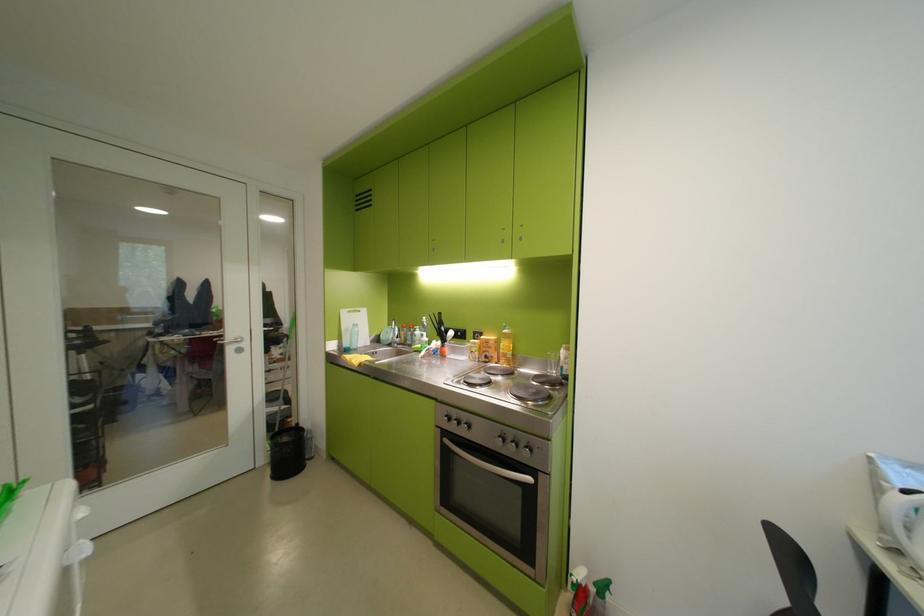
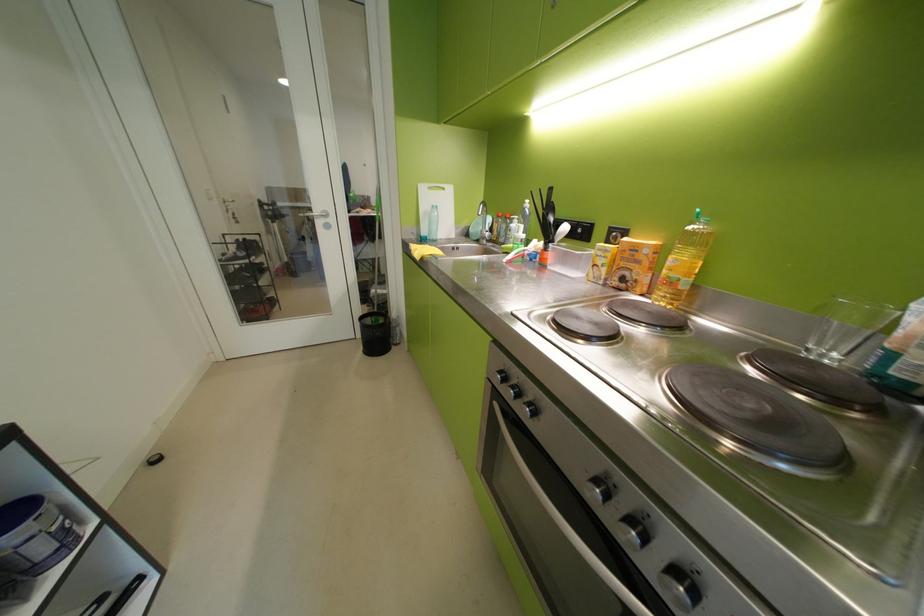
Where in the second image is the point corresponding to the point at 456,350 from the first image?

(561, 256)